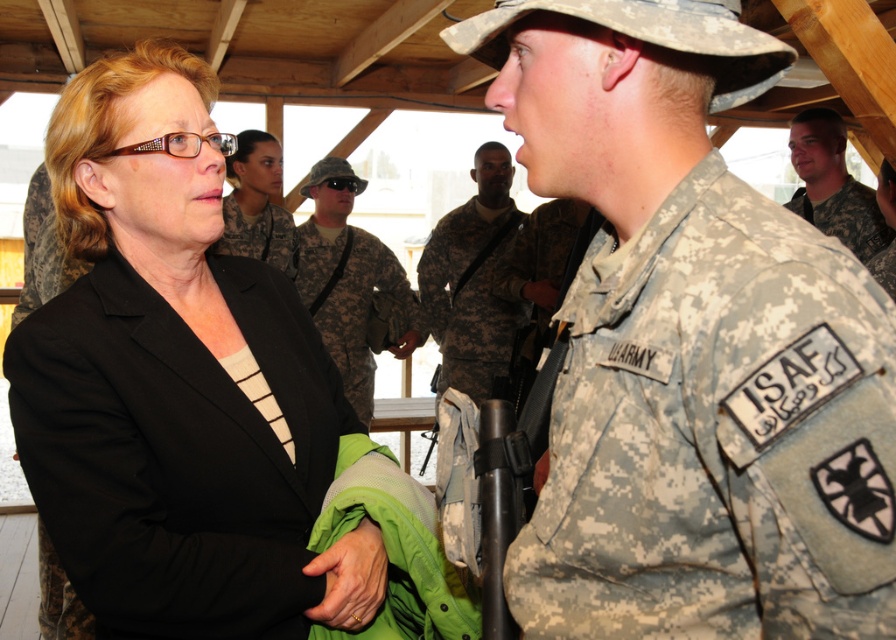
Which is more to the left, camouflage fabric uniform at center or matte black jacket at center?

From the viewer's perspective, matte black jacket at center appears more on the left side.

Does camouflage fabric uniform at center appear over matte black jacket at center?

Incorrect, camouflage fabric uniform at center is not positioned above matte black jacket at center.

Locate an element on the screen. Image resolution: width=896 pixels, height=640 pixels. camouflage fabric uniform at center is located at coordinates (x=351, y=301).

Can you confirm if camouflage uniform at right is positioned above matte black jacket at center?

Yes, camouflage uniform at right is above matte black jacket at center.

Who is lower down, camouflage uniform at right or matte black jacket at center?

matte black jacket at center is lower down.

Does point (830, 227) come closer to viewer compared to point (260, 195)?

Yes, it is.

Identify the location of camouflage uniform at right. (832, 184).

The height and width of the screenshot is (640, 896). What do you see at coordinates (716, 433) in the screenshot?
I see `camouflage fabric uniform at right` at bounding box center [716, 433].

Does camouflage fabric uniform at right have a greater width compared to camouflage fabric uniform at center?

No, camouflage fabric uniform at right is not wider than camouflage fabric uniform at center.

At what (x,y) coordinates should I click in order to perform the action: click on camouflage fabric uniform at right. Please return your answer as a coordinate pair (x, y). Image resolution: width=896 pixels, height=640 pixels. Looking at the image, I should click on (716, 433).